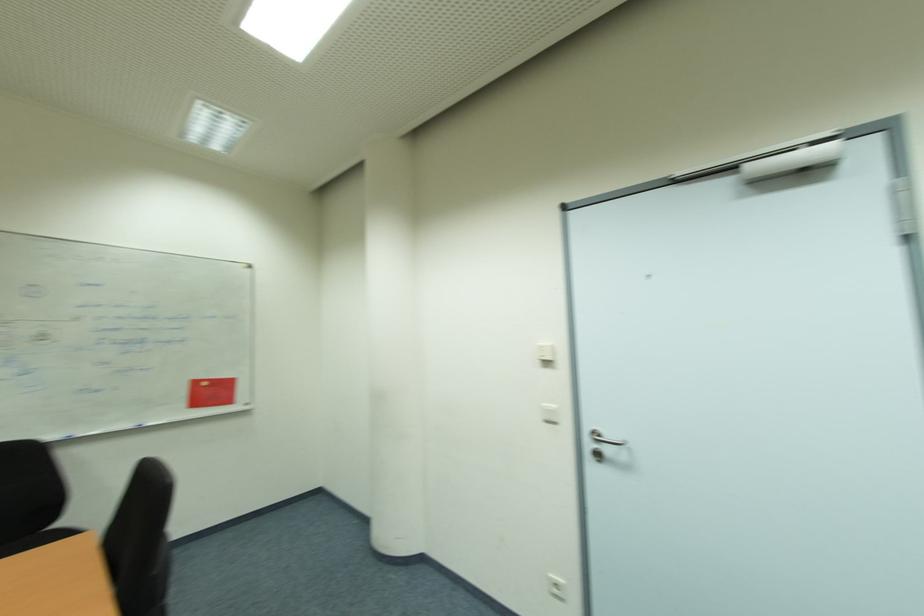
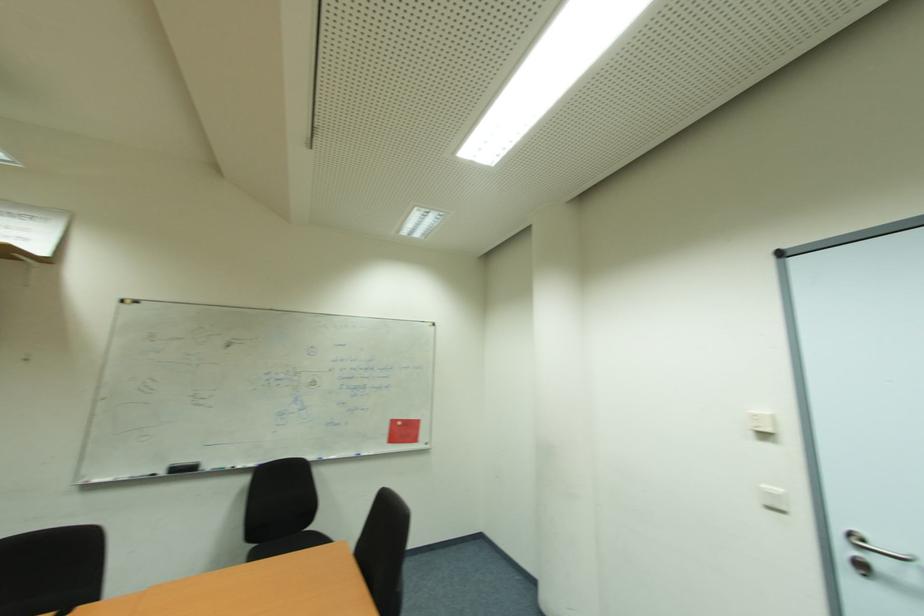
Locate, in the second image, the point that corresponds to point (556, 407) in the first image.

(784, 492)